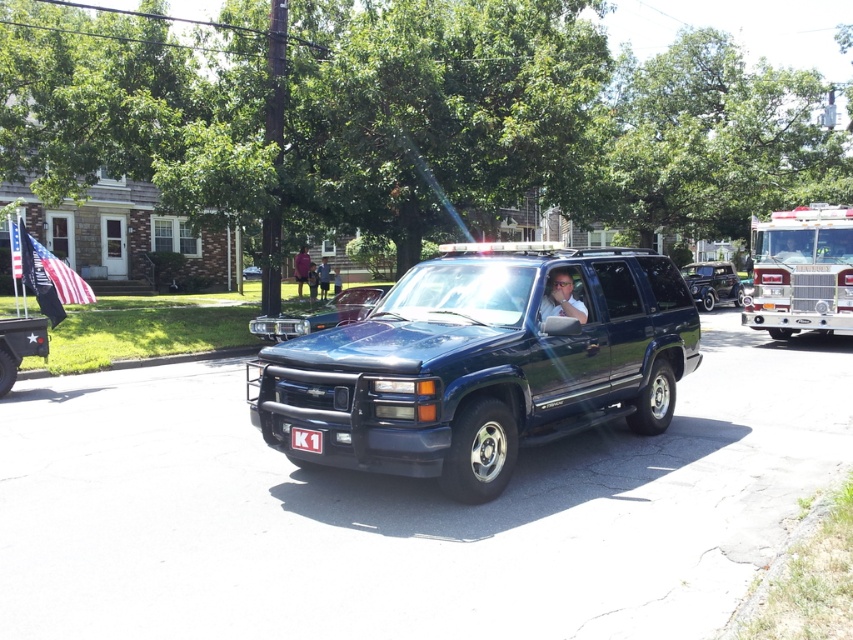
Is glossy dark blue suv at center positioned in front of red metallic fire truck at right?

Yes.

Describe the element at coordinates (482, 364) in the screenshot. I see `glossy dark blue suv at center` at that location.

Does point (646, 348) come behind point (825, 305)?

No, (646, 348) is closer to viewer.

Image resolution: width=853 pixels, height=640 pixels. In order to click on glossy dark blue suv at center in this screenshot , I will do pyautogui.click(x=482, y=364).

Between matte black shirt at center and black plastic license plate at center, which one is positioned lower?

Positioned lower is black plastic license plate at center.

Is point (578, 301) behind point (294, 428)?

Yes, it is behind point (294, 428).

Image resolution: width=853 pixels, height=640 pixels. I want to click on matte black shirt at center, so click(561, 300).

Image resolution: width=853 pixels, height=640 pixels. What do you see at coordinates (802, 273) in the screenshot?
I see `red metallic fire truck at right` at bounding box center [802, 273].

Can you confirm if red metallic fire truck at right is positioned to the right of pink fabric shirt at center?

Indeed, red metallic fire truck at right is positioned on the right side of pink fabric shirt at center.

Image resolution: width=853 pixels, height=640 pixels. I want to click on red metallic fire truck at right, so click(x=802, y=273).